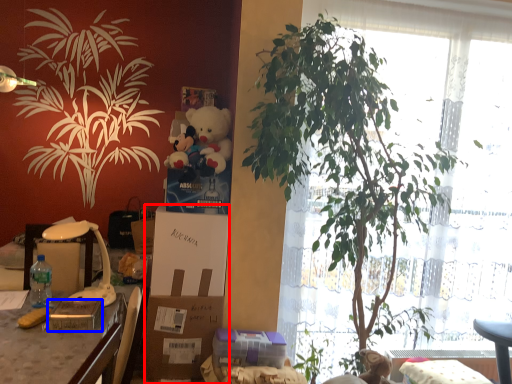
Question: Which object appears closest to the camera in this image, box (highlighted by a red box) or gift (highlighted by a blue box)?

Choices:
 (A) box
 (B) gift

Answer: (B)